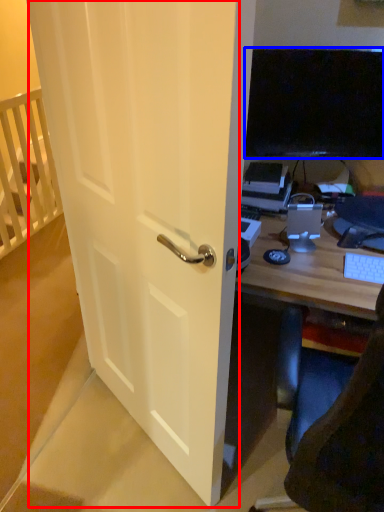
Question: Which object appears farthest to the camera in this image, screen door (highlighted by a red box) or television (highlighted by a blue box)?

Choices:
 (A) screen door
 (B) television

Answer: (B)